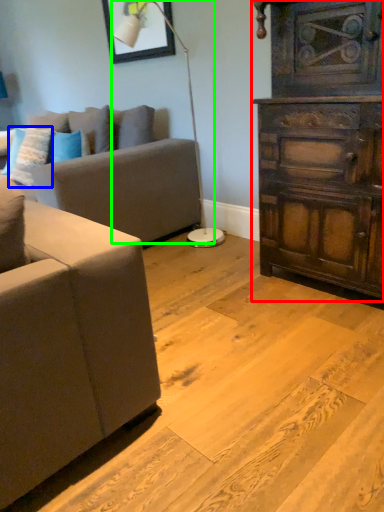
Question: Which object is the farthest from chest of drawers (highlighted by a red box)? Choose among these: pillow (highlighted by a blue box) or lamp (highlighted by a green box).

Choices:
 (A) pillow
 (B) lamp

Answer: (A)